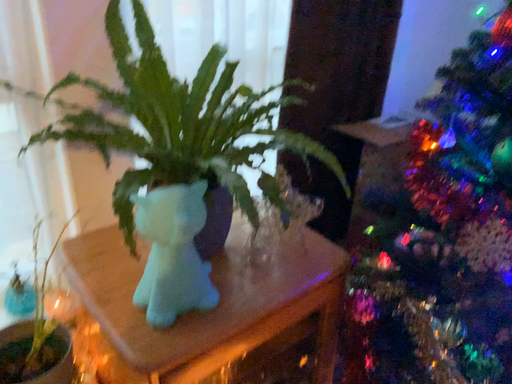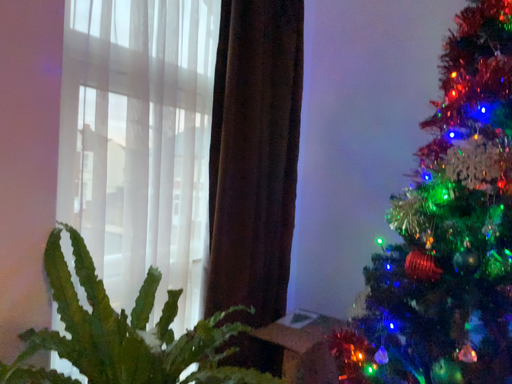
Question: Which way did the camera rotate in the video?

Choices:
 (A) rotated right
 (B) rotated left

Answer: (A)